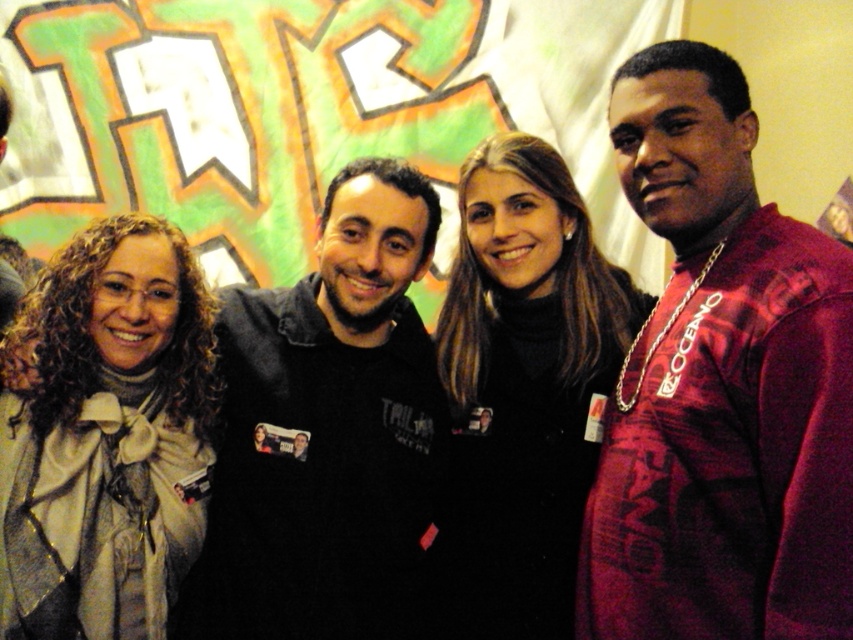
Question: Is shiny maroon shirt at right positioned before light beige scarf at center?

Choices:
 (A) no
 (B) yes

Answer: (B)

Question: Can you confirm if shiny maroon shirt at right is positioned to the left of black fleece at center?

Choices:
 (A) yes
 (B) no

Answer: (B)

Question: Estimate the real-world distances between objects in this image. Which object is farther from the shiny maroon shirt at right?

Choices:
 (A) black fleece at center
 (B) black matte jacket at center
 (C) light beige scarf at center

Answer: (C)

Question: Which point appears farthest from the camera in this image?

Choices:
 (A) (332, 477)
 (B) (9, 481)

Answer: (A)

Question: Which point is closer to the camera?

Choices:
 (A) light beige scarf at center
 (B) black fleece at center
 (C) shiny maroon shirt at right
 (D) black matte jacket at center

Answer: (C)

Question: Is black fleece at center thinner than light beige scarf at center?

Choices:
 (A) no
 (B) yes

Answer: (A)